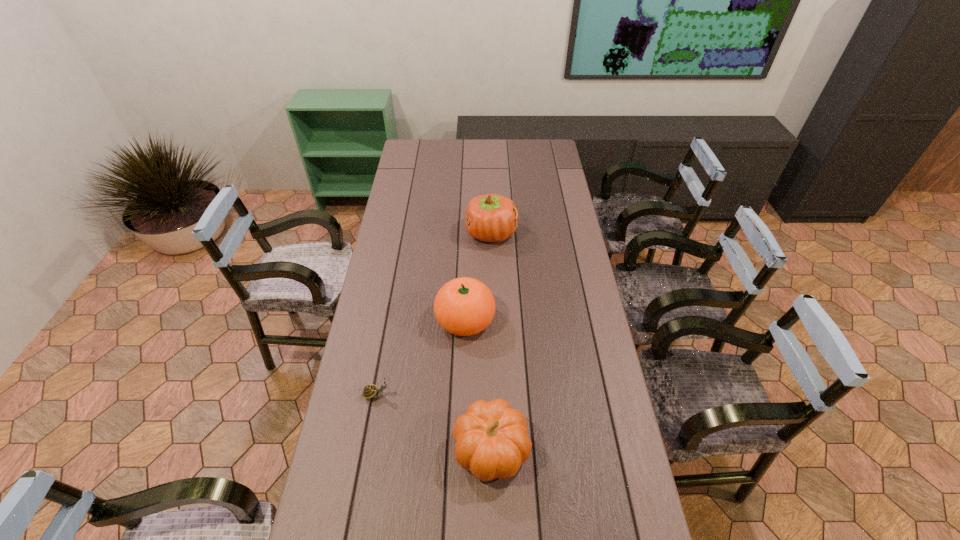
Where is `the farthest pumpkin`? the farthest pumpkin is located at coordinates (492, 218).

Find the location of a particular element. This screenshot has width=960, height=540. the second nearest pumpkin is located at coordinates point(464,306).

Find the location of a particular element. the nearest object is located at coordinates (491, 438).

Find the location of a particular element. Image resolution: width=960 pixels, height=540 pixels. the leftmost object is located at coordinates (371, 391).

Locate an element on the screen. This screenshot has height=540, width=960. snail is located at coordinates (371, 391).

The height and width of the screenshot is (540, 960). What are the coordinates of `free space located on the side of the farthest object with the cute face` in the screenshot? It's located at (421, 233).

Locate an element on the screen. free space located on the side of the farthest object with the cute face is located at coordinates (399, 233).

This screenshot has height=540, width=960. I want to click on vacant position located 0.090m on the side of the farthest object with the cute face, so click(444, 233).

Locate an element on the screen. This screenshot has height=540, width=960. free space located 0.290m on the back of the second farthest pumpkin is located at coordinates (468, 242).

Where is `free space located on the left of the nearest pumpkin`? Image resolution: width=960 pixels, height=540 pixels. free space located on the left of the nearest pumpkin is located at coordinates (405, 449).